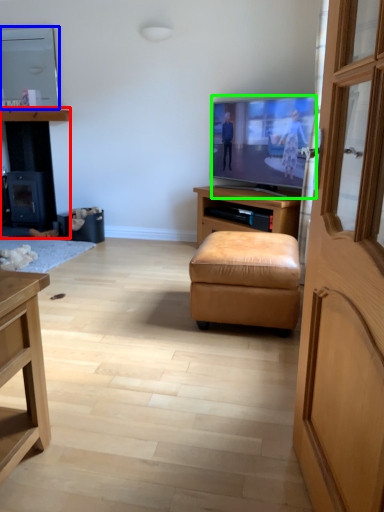
Question: Which object is the closest to the dresser (highlighted by a red box)? Choose among these: television (highlighted by a blue box) or television (highlighted by a green box).

Choices:
 (A) television
 (B) television

Answer: (A)